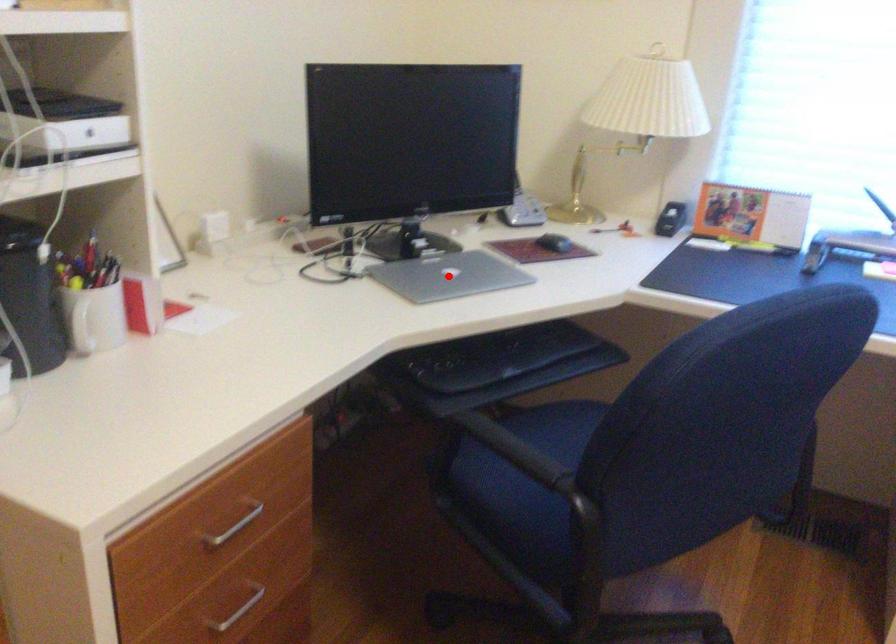
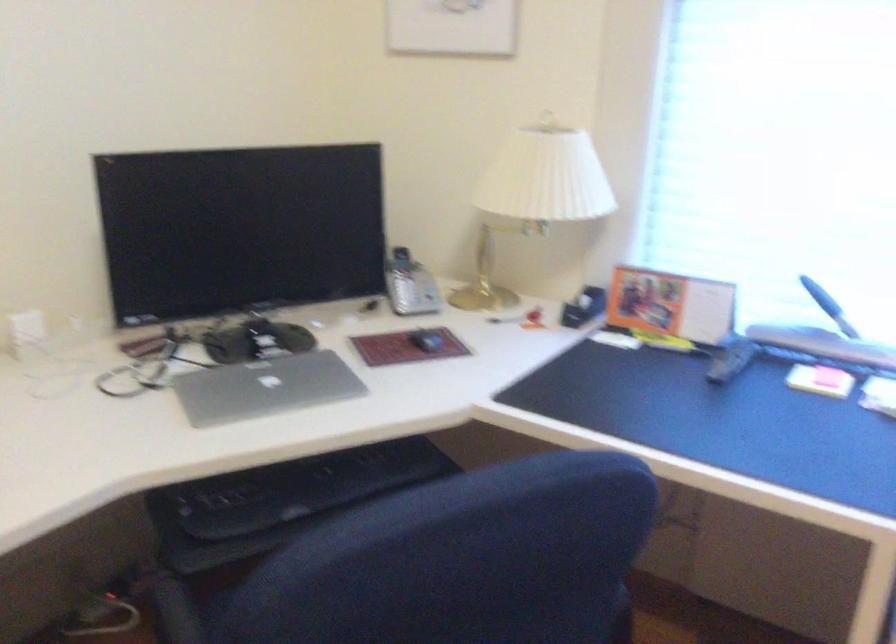
Where in the second image is the point corresponding to the highlighted location from the first image?

(264, 386)